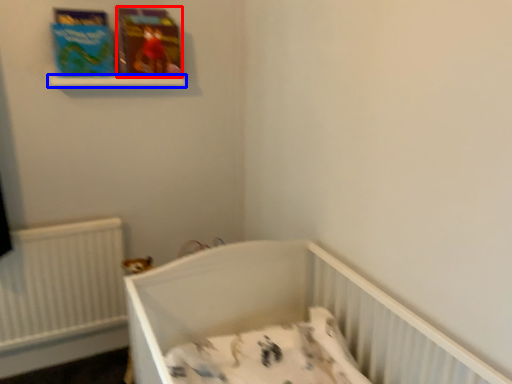
Question: Which point is further to the camera, paperback book (highlighted by a red box) or balustrade (highlighted by a blue box)?

Choices:
 (A) paperback book
 (B) balustrade

Answer: (A)